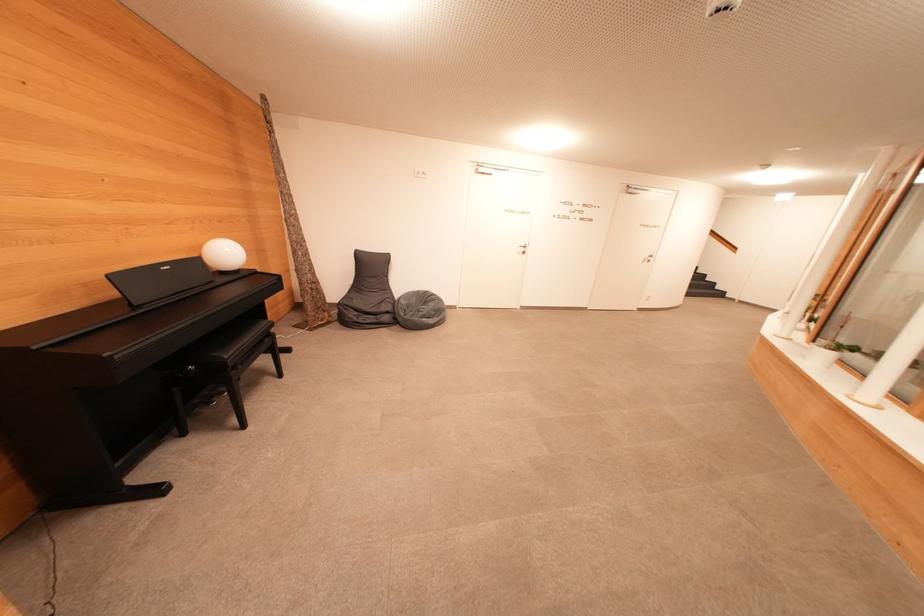
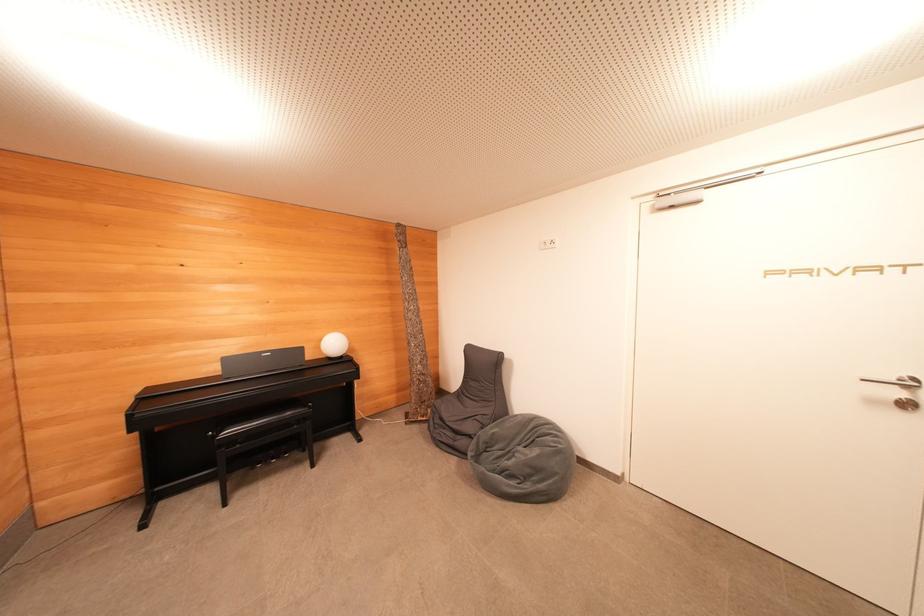
Find the pixel in the second image that matches the point at 119,282 in the first image.

(229, 363)